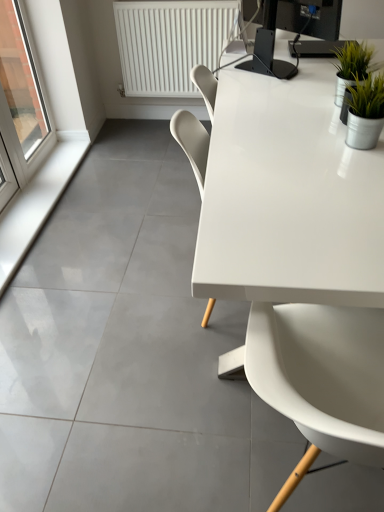
Question: Is green metallic pot at upper right in front of or behind black glossy monitor at upper right in the image?

Choices:
 (A) behind
 (B) front

Answer: (B)

Question: Considering the positions of green metallic pot at upper right and black glossy monitor at upper right in the image, is green metallic pot at upper right taller or shorter than black glossy monitor at upper right?

Choices:
 (A) short
 (B) tall

Answer: (A)

Question: Based on their relative distances, which object is farther from the green metallic pot at upper right?

Choices:
 (A) white glossy chair at center
 (B) white plastic radiator at upper center
 (C) white smooth window sill at lower left
 (D) black glossy monitor at upper right
 (E) white glossy table at upper right

Answer: (C)

Question: Which of these objects is positioned farthest from the white plastic radiator at upper center?

Choices:
 (A) black glossy monitor at upper right
 (B) white smooth window sill at lower left
 (C) white glossy chair at center
 (D) green metallic pot at upper right
 (E) transparent glass window at left

Answer: (C)